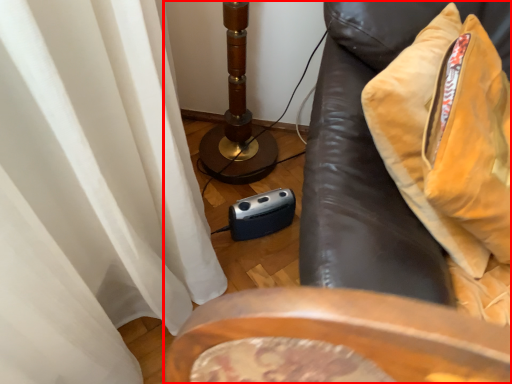
Question: From the image's perspective, where is furniture (annotated by the red box) located relative to throw pillow?

Choices:
 (A) above
 (B) below

Answer: (B)